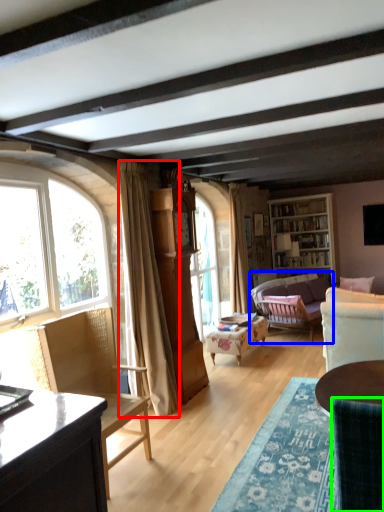
Question: Considering the real-world distances, which object is closest to curtain (highlighted by a red box)? studio couch (highlighted by a blue box) or chair (highlighted by a green box).

Choices:
 (A) studio couch
 (B) chair

Answer: (B)